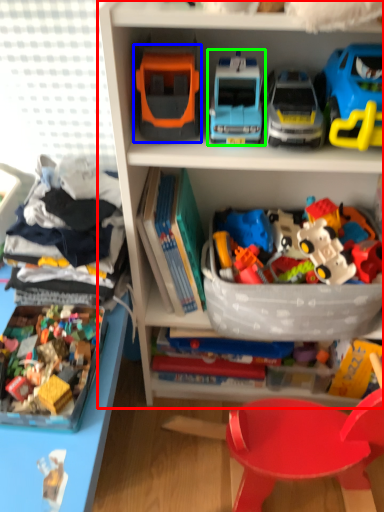
Question: Based on their relative distances, which object is farther from bookcase (highlighted by a red box)? Choose from toy (highlighted by a blue box) and toy (highlighted by a green box).

Choices:
 (A) toy
 (B) toy

Answer: (A)